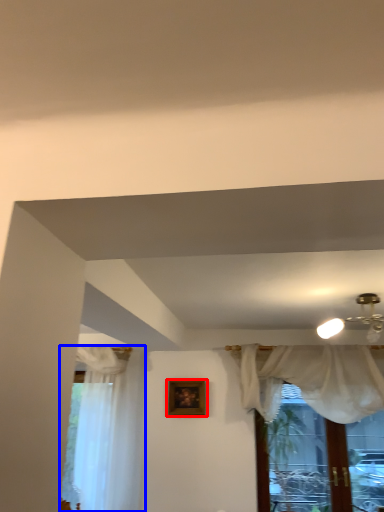
Question: Which object is further to the camera taking this photo, picture frame (highlighted by a red box) or curtain (highlighted by a blue box)?

Choices:
 (A) picture frame
 (B) curtain

Answer: (A)